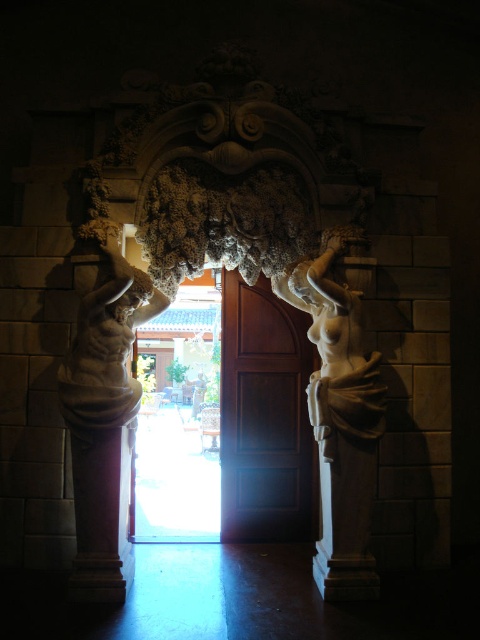
Question: Which object appears farthest from the camera in this image?

Choices:
 (A) white marble statue at right
 (B) wooden panel door at center

Answer: (B)

Question: Can you confirm if wooden panel door at center is thinner than marble statue at left?

Choices:
 (A) no
 (B) yes

Answer: (A)

Question: Which object is closer to the camera taking this photo?

Choices:
 (A) white marble statue at right
 (B) wooden panel door at center
 (C) white marble statue at left
 (D) marble statue at left

Answer: (D)

Question: Can you confirm if wooden panel door at center is bigger than white marble statue at right?

Choices:
 (A) yes
 (B) no

Answer: (B)

Question: Which point is farther to the camera?

Choices:
 (A) white marble statue at right
 (B) white marble statue at left
 (C) wooden panel door at center

Answer: (C)

Question: Can you confirm if wooden panel door at center is wider than marble statue at left?

Choices:
 (A) yes
 (B) no

Answer: (A)